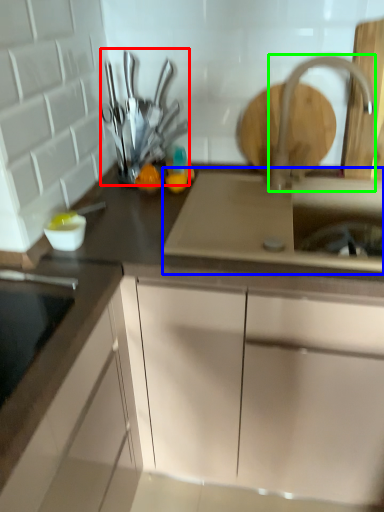
Question: Which object is positioned closest to tableware (highlighted by a red box)? Select from sink (highlighted by a blue box) and tap (highlighted by a green box).

Choices:
 (A) sink
 (B) tap

Answer: (A)